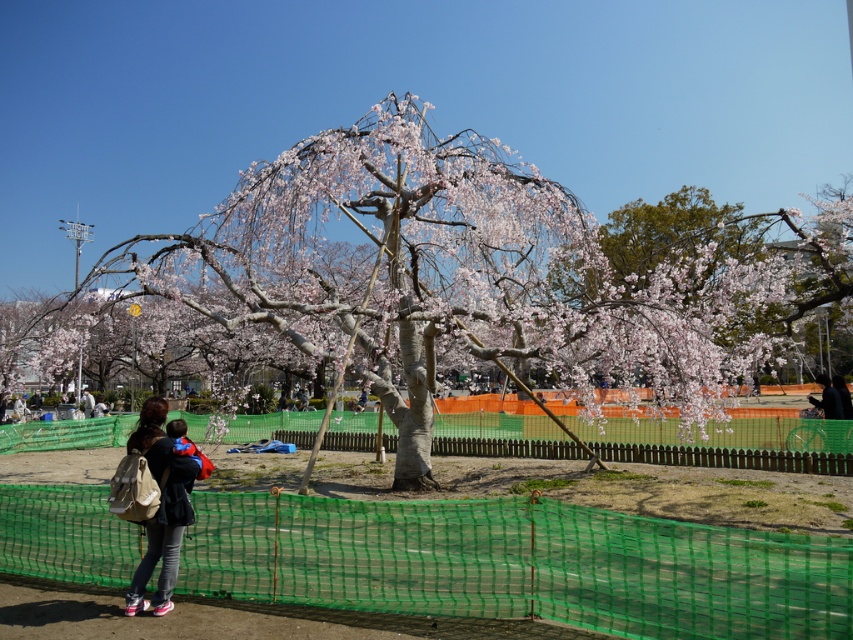
You are planning to place a small potted plant between the green mesh net at lower center and the matte beige backpack at lower left. Based on their heights, which object will the top of the potted plant be closer to?

The green mesh net at lower center has a lesser height compared to matte beige backpack at lower left, so the top of the potted plant placed between them will be closer to the matte beige backpack at lower left.

You are standing at the point labeled as point (469, 300) in the image. What object are you closest to?

You are closest to the pink blossoming tree at center because the point (469, 300) is on it.

You are planning to place a new bench in this outdoor area. The bench will be placed between the matte beige backpack at lower left and the dark blue shirt at center. Considering their sizes, which object will the bench be closer to?

The bench will be closer to the dark blue shirt at center because the matte beige backpack at lower left occupies less space than the dark blue shirt at center, meaning the dark blue shirt at center is larger and thus the bench should be placed nearer to it to maintain balance.